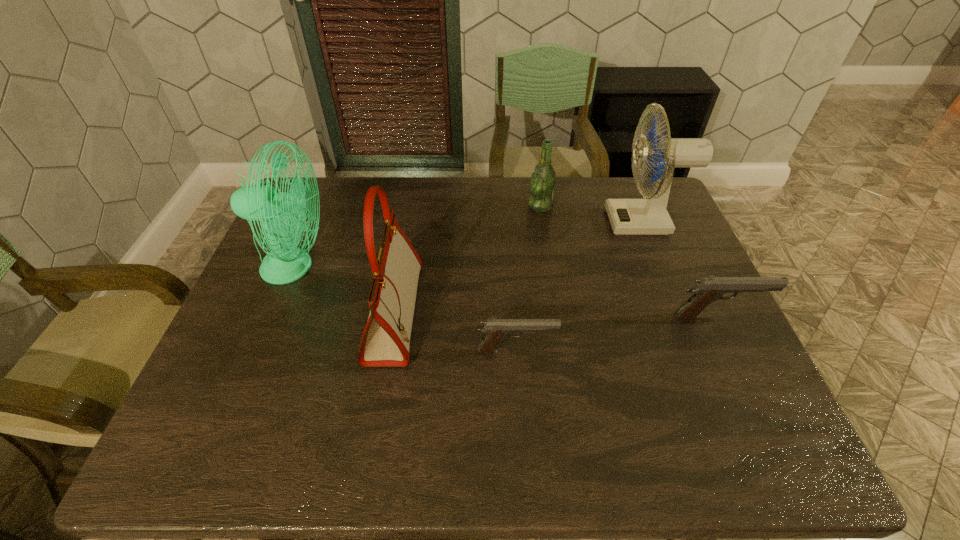
Locate an element on the screen. unoccupied area between the shorter pistol and the third shortest object is located at coordinates (528, 279).

What are the coordinates of `vacant area that lies between the right fan and the nearer pistol` in the screenshot? It's located at (580, 286).

I want to click on vacant point located between the beer bottle and the shortest object, so click(528, 279).

You are a GUI agent. You are given a task and a screenshot of the screen. Output one action in this format:
    pyautogui.click(x=<x>, y=<y>)
    Task: Click on the free space between the right pistol and the right fan
    
    Given the screenshot: What is the action you would take?
    pyautogui.click(x=681, y=269)

Find the location of a particular element. The image size is (960, 540). free point between the right fan and the handbag is located at coordinates (518, 267).

Where is `the third closest object relative to the taller pistol`? This screenshot has width=960, height=540. the third closest object relative to the taller pistol is located at coordinates (543, 180).

I want to click on object that can be found as the third closest to the right fan, so click(495, 330).

In order to click on blank area in the image that satisfies the following two spatial constraints: 1. in front of the leftmost object to blow air; 2. on the back side of the handbag in this screenshot , I will do `click(276, 313)`.